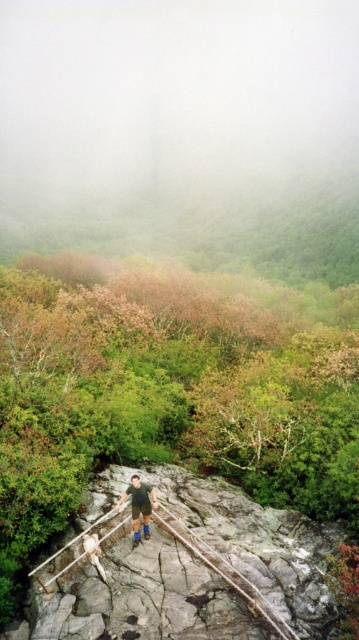
Question: Can you confirm if rusty metal suspension bridge at center is positioned to the left of blue denim shorts at center?

Choices:
 (A) yes
 (B) no

Answer: (B)

Question: Among these points, which one is nearest to the camera?

Choices:
 (A) (132, 492)
 (B) (215, 541)

Answer: (A)

Question: Is rusty metal suspension bridge at center thinner than blue denim shorts at center?

Choices:
 (A) no
 (B) yes

Answer: (A)

Question: Does rusty metal suspension bridge at center lie in front of blue denim shorts at center?

Choices:
 (A) no
 (B) yes

Answer: (B)

Question: Which object is closer to the camera taking this photo?

Choices:
 (A) blue denim shorts at center
 (B) rusty metal suspension bridge at center

Answer: (B)